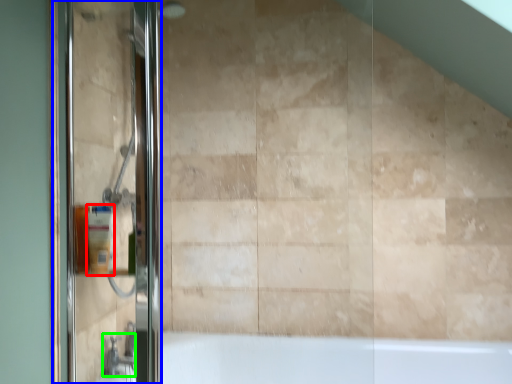
Question: Estimate the real-world distances between objects in this image. Which object is closer to toiletry (highlighted by a red box), screen door (highlighted by a blue box) or faucet (highlighted by a green box)?

Choices:
 (A) screen door
 (B) faucet

Answer: (A)